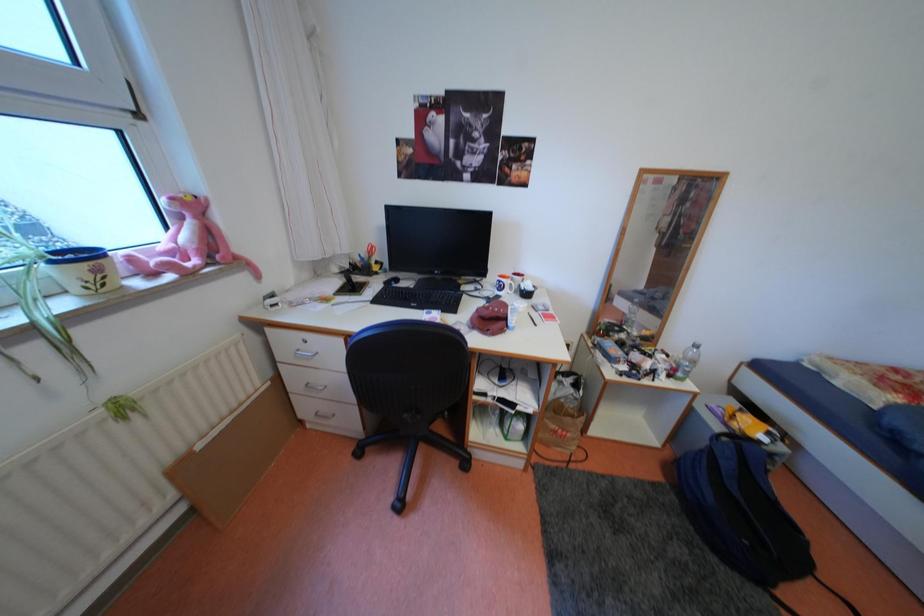
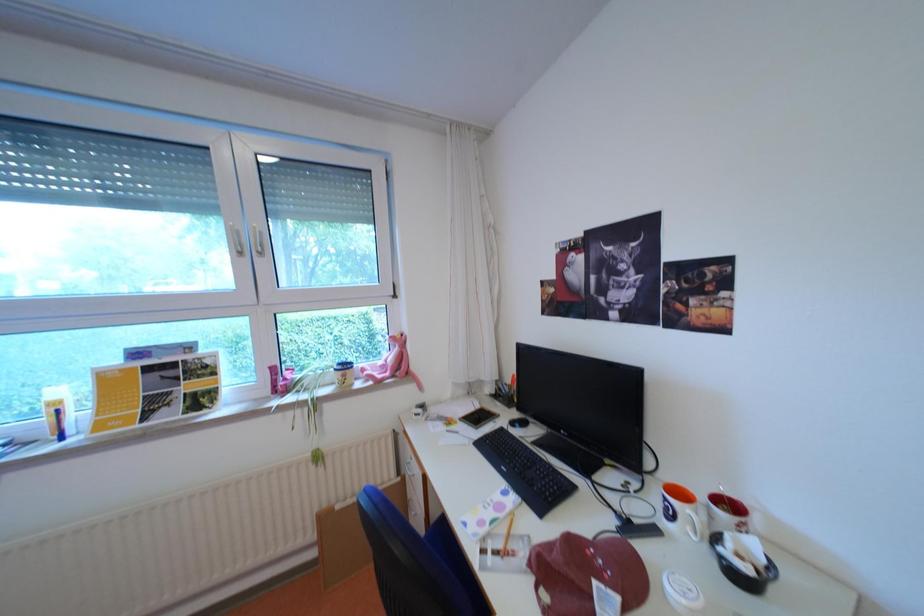
Question: The first image is from the beginning of the video and the second image is from the end. How did the camera likely rotate when shooting the video?

Choices:
 (A) Left
 (B) Right
 (C) Up
 (D) Down

Answer: (A)